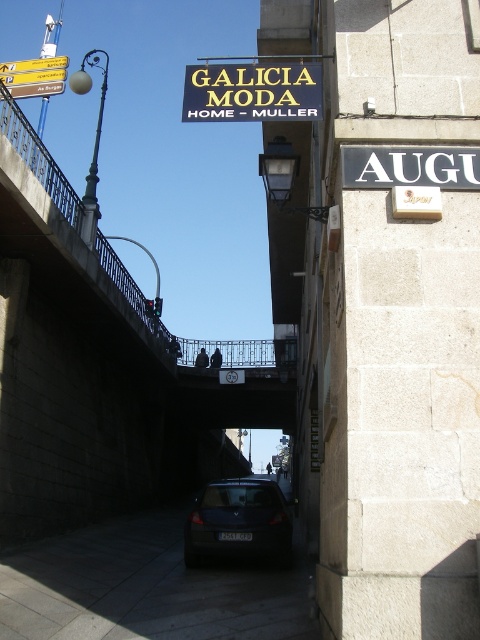
Does dark gray matte car at center appear over metallic streetlamp at left?

No.

Is dark gray matte car at center bigger than metallic streetlamp at left?

No, dark gray matte car at center is not bigger than metallic streetlamp at left.

Where is `dark gray matte car at center`? The image size is (480, 640). dark gray matte car at center is located at coordinates (239, 522).

Find the location of `dark gray matte car at center`. dark gray matte car at center is located at coordinates (239, 522).

Which of these two, concrete bridge at upper center or gold metallic sign at upper center, stands taller?

Standing taller between the two is concrete bridge at upper center.

Who is more forward, (194, 417) or (194, 83)?

Positioned in front is point (194, 83).

The image size is (480, 640). I want to click on concrete bridge at upper center, so click(214, 368).

Who is taller, gold metallic sign at upper center or yellow plastic sign at upper center?

yellow plastic sign at upper center

This screenshot has width=480, height=640. Describe the element at coordinates (252, 92) in the screenshot. I see `gold metallic sign at upper center` at that location.

This screenshot has height=640, width=480. I want to click on gold metallic sign at upper center, so click(252, 92).